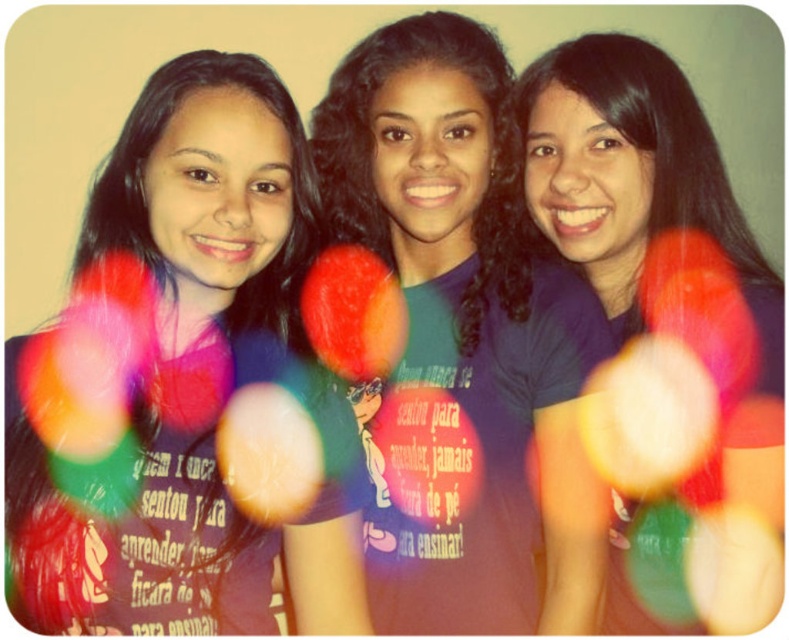
You are a photographer who wants to ensure that both the matte purple shirt at center and the purple matte shirt at center are clearly visible in the photo. Given that one is smaller than the other, which one might require you to adjust your focus to capture details better?

The matte purple shirt at center has a smaller size compared to the purple matte shirt at center, so the smaller one might need closer focus to capture details better.

You are taking a photo of the three people in the scene. You want to focus on the point closer to the camera between the two points, point (227,163) and point (765,326). Which point should you focus on?

You should focus on point (227,163) because it is closer to the camera than point (765,326).

You are a photographer who wants to adjust the lighting setup for a photo shoot. You notice a point at coordinates [196,392] in the image. What object is located at this point?

The point at coordinates [196,392] corresponds to the matte purple shirt at center.